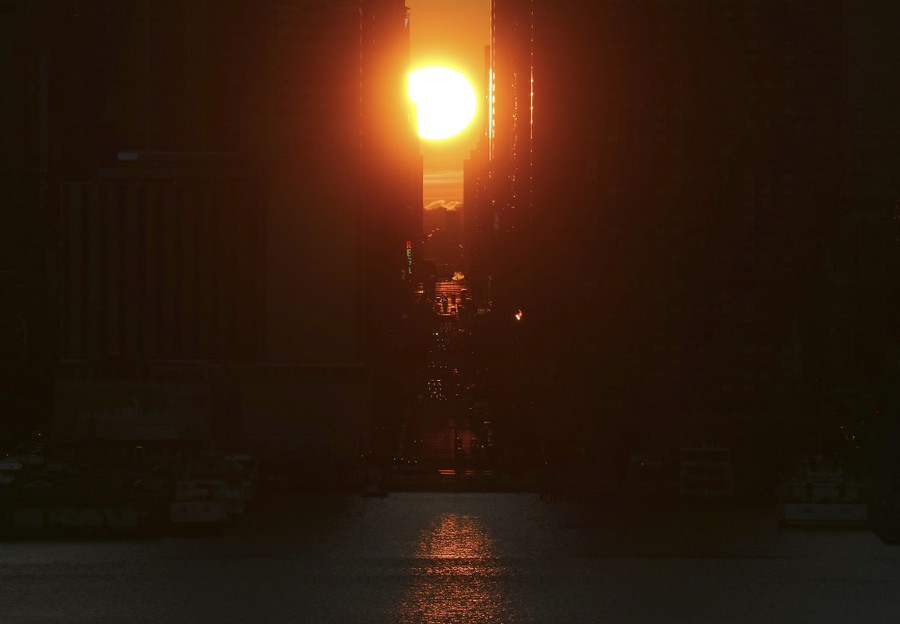
Identify the location of light. The height and width of the screenshot is (624, 900). (430, 100).